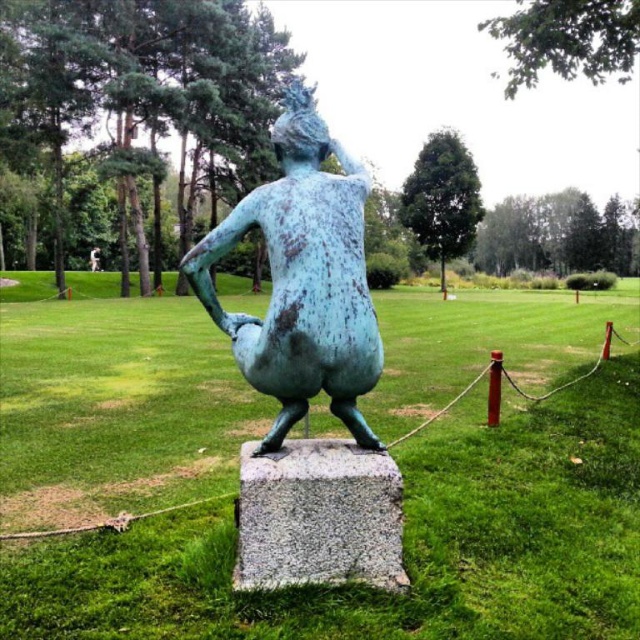
You are standing at the center of the park and want to locate the green patinated bronze statue at center. According to the coordinates provided, in which direction should you walk from your current position to reach it?

The green patinated bronze statue at center is located at coordinates point (403,541). Since you are at the center of the park, which is point (320,320), you should walk northeast to reach it.

You are an art student analyzing the statue in the park. You notice two descriptions of the same statue. One calls it a green patinated bronze statue at center, and the other refers to it as a green patina statue at center. Which description is more accurate based on the statue details?

The green patinated bronze statue at center is more accurate because it specifies the material as bronze and the patina process, whereas the green patina statue at center lacks the material detail.

You are standing in the park and want to take a photo of the green patina statue at center. If you position yourself directly in front of the statue, where should you aim your camera to capture the statue in the center of your photo?

Since the 2D location of the green patina statue at center is at point (301, 278), you should aim your camera slightly below and to the right of the center point to ensure the statue is centered in your photo.